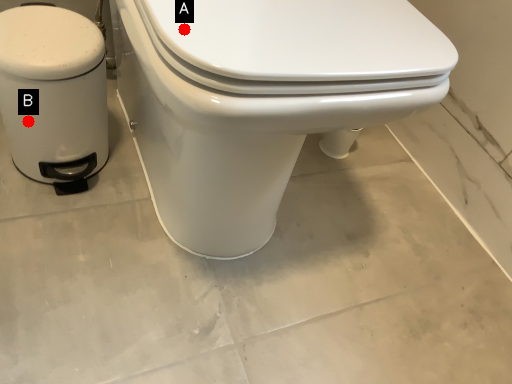
Question: Two points are circled on the image, labeled by A and B beside each circle. Among these points, which one is farthest from the camera?

Choices:
 (A) A is further
 (B) B is further

Answer: (B)